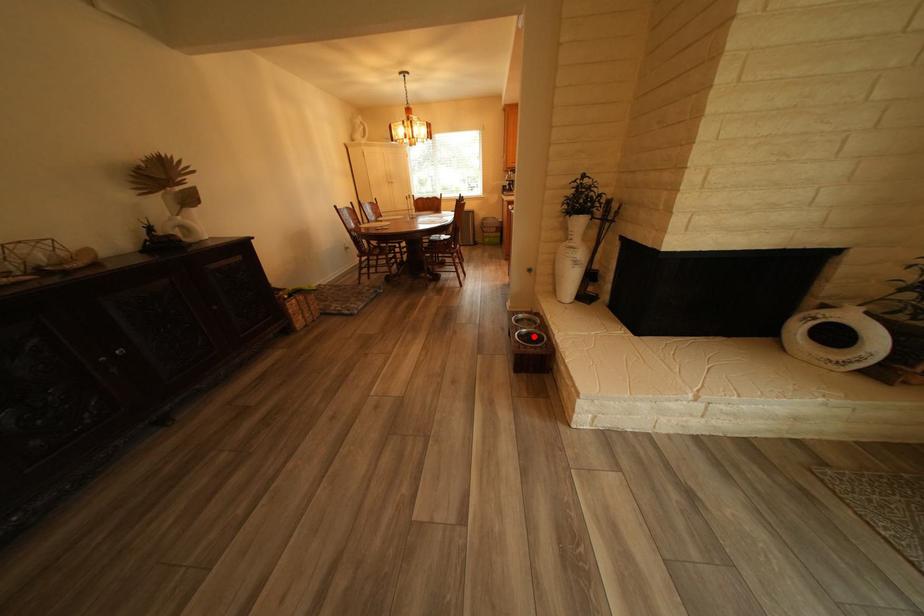
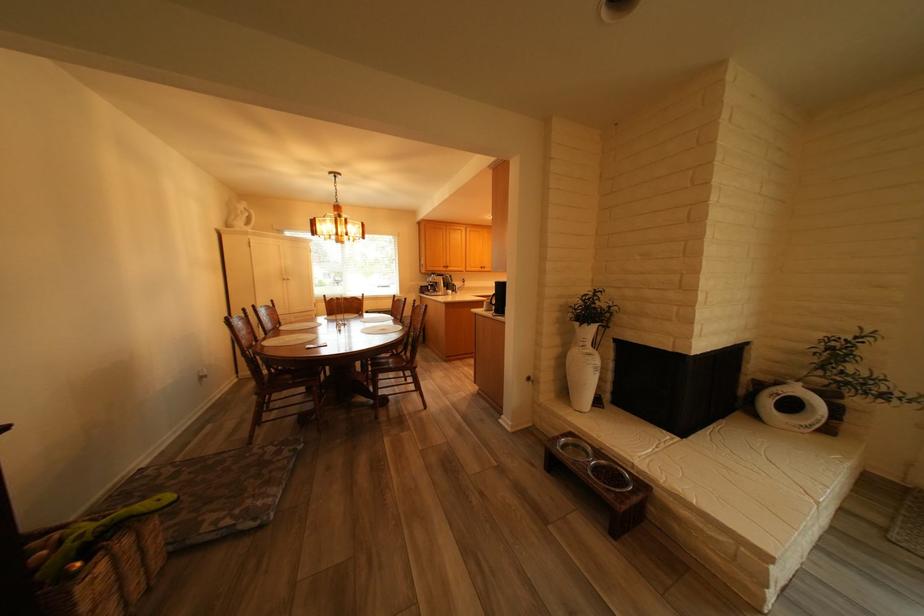
In the second image, find the point that corresponds to the highlighted location in the first image.

(609, 477)